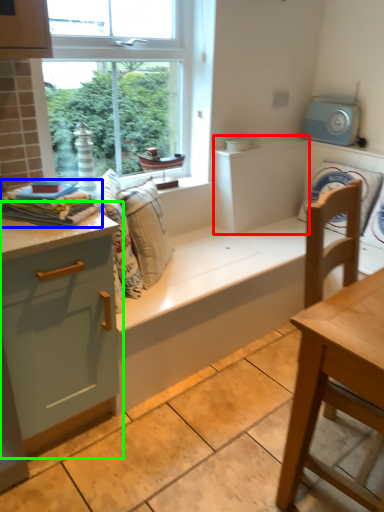
Question: Estimate the real-world distances between objects in this image. Which object is closer to cabinetry (highlighted by a red box), material (highlighted by a blue box) or dresser (highlighted by a green box)?

Choices:
 (A) material
 (B) dresser

Answer: (A)